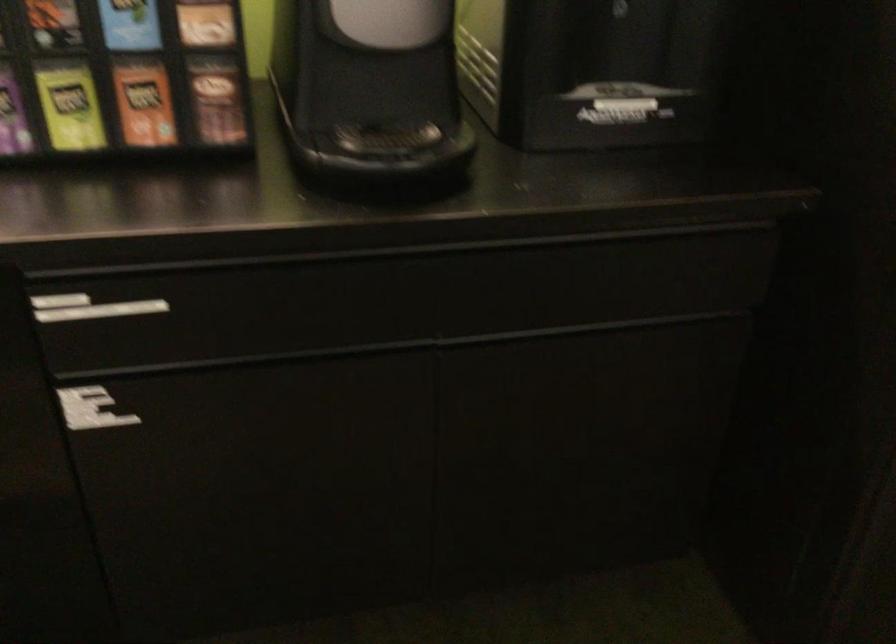
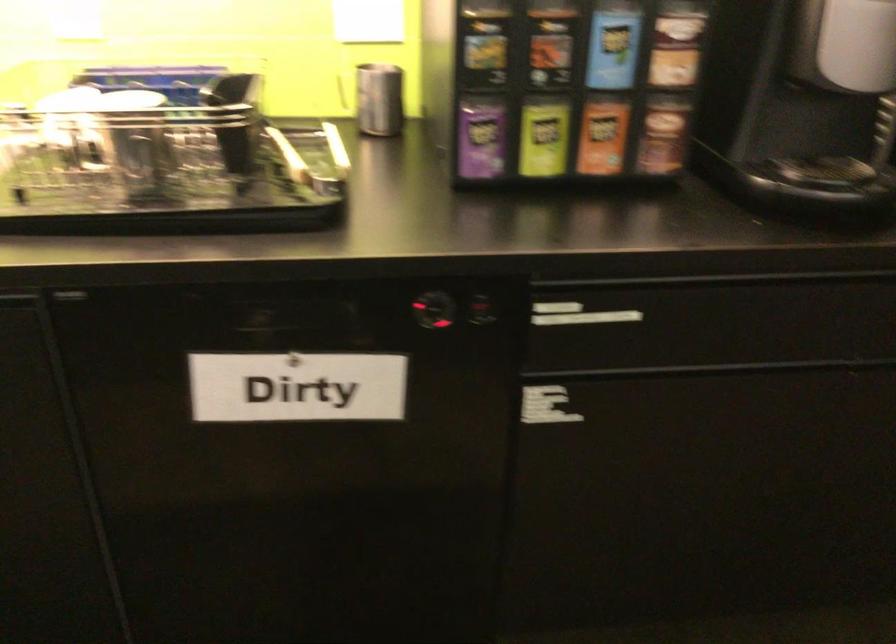
Find the pixel in the second image that matches (x=73, y=107) in the first image.

(543, 138)